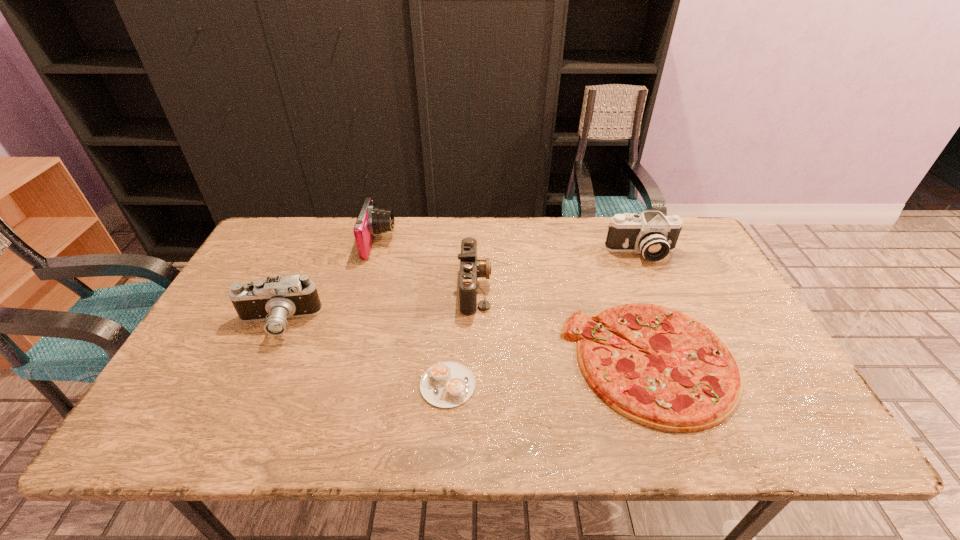
I want to click on vacant space at the left edge, so click(223, 300).

At what (x,y) coordinates should I click in order to perform the action: click on vacant area at the far left corner. Please return your answer as a coordinate pair (x, y). Looking at the image, I should click on (303, 221).

In the image, there is a desktop. Identify the location of free space at the far right corner. The image size is (960, 540). (691, 239).

Where is `vacant space that's between the second shortest object and the third camera from left to right`? The image size is (960, 540). vacant space that's between the second shortest object and the third camera from left to right is located at coordinates (562, 324).

Locate an element on the screen. unoccupied position between the third camera from left to right and the leftmost object is located at coordinates (376, 305).

This screenshot has height=540, width=960. I want to click on empty location between the leftmost camera and the third camera from left to right, so click(376, 305).

Where is `empty space between the leftmost camera and the fifth object from right to left`? empty space between the leftmost camera and the fifth object from right to left is located at coordinates (328, 283).

The height and width of the screenshot is (540, 960). I want to click on vacant point located between the pizza and the second camera from left to right, so click(x=515, y=302).

Locate an element on the screen. Image resolution: width=960 pixels, height=540 pixels. vacant space that is in between the fifth object from right to left and the second camera from right to left is located at coordinates (427, 265).

At what (x,y) coordinates should I click in order to perform the action: click on unoccupied area between the shortest object and the pizza. Please return your answer as a coordinate pair (x, y). Looking at the image, I should click on (548, 373).